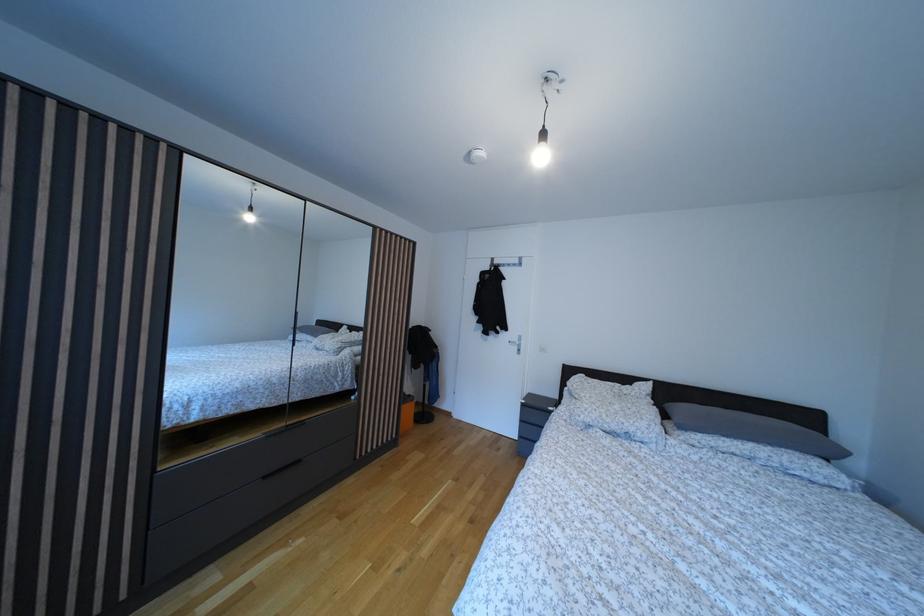
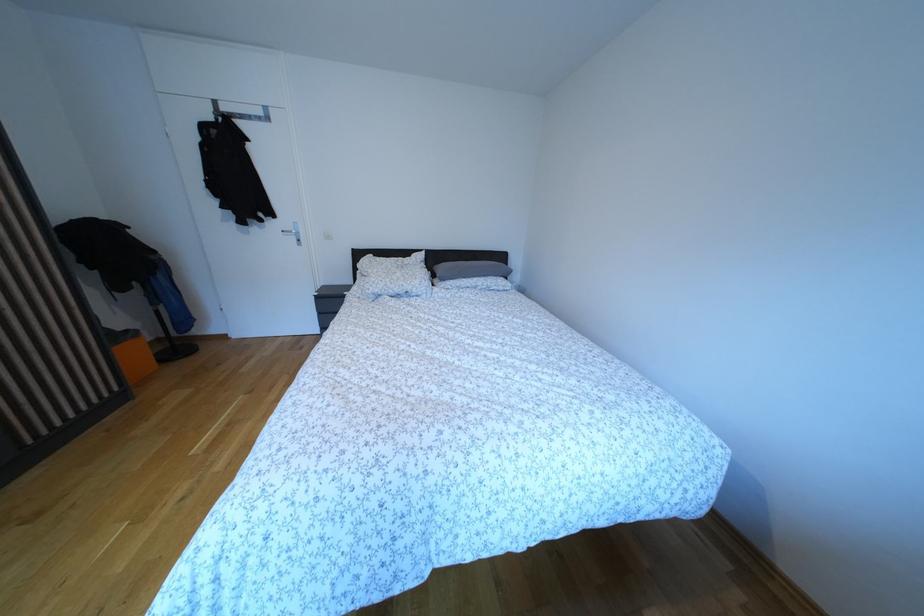
The point at (417, 402) is marked in the first image. Where is the corresponding point in the second image?

(134, 338)